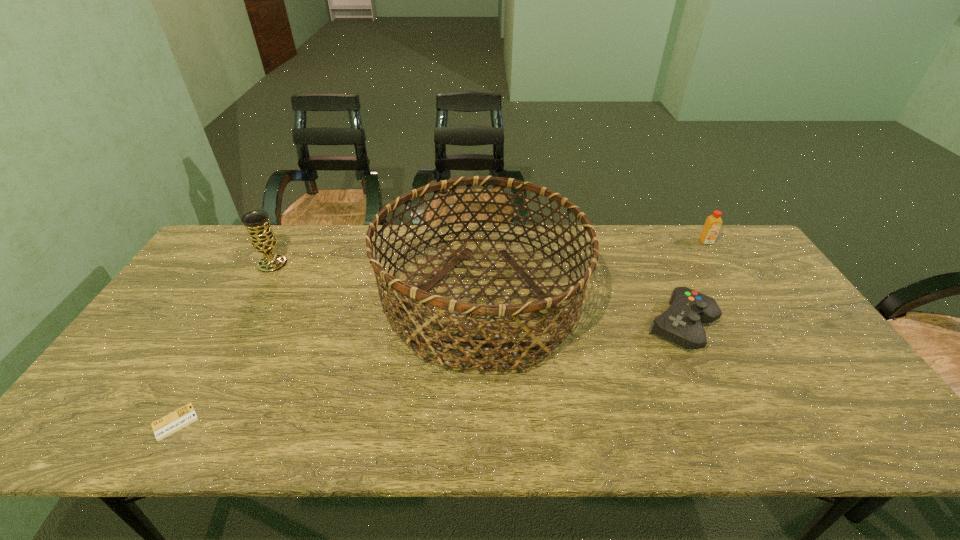
Where is `vacant area situated 0.110m on the front of the chalice`? Image resolution: width=960 pixels, height=540 pixels. vacant area situated 0.110m on the front of the chalice is located at coordinates (253, 297).

You are a GUI agent. You are given a task and a screenshot of the screen. Output one action in this format:
    pyautogui.click(x=<x>, y=<y>)
    Task: Click on the vacant space located 0.170m on the front and back of the third tallest object
    The width and height of the screenshot is (960, 540).
    Given the screenshot: What is the action you would take?
    pyautogui.click(x=731, y=279)

Locate an element on the screen. blank space located on the back of the second shortest object is located at coordinates (650, 257).

Find the location of `free space located on the right of the nearest object`. free space located on the right of the nearest object is located at coordinates (254, 422).

Find the location of `basket that is at the far edge`. basket that is at the far edge is located at coordinates (410, 294).

The image size is (960, 540). I want to click on chalice that is at the far edge, so click(x=262, y=238).

Image resolution: width=960 pixels, height=540 pixels. I want to click on orange juice situated at the far edge, so click(x=713, y=223).

This screenshot has width=960, height=540. In order to click on object that is at the near edge in this screenshot , I will do `click(171, 423)`.

Image resolution: width=960 pixels, height=540 pixels. What are the coordinates of `object located at the right edge` in the screenshot? It's located at (713, 223).

This screenshot has width=960, height=540. I want to click on object that is at the far right corner, so click(x=713, y=223).